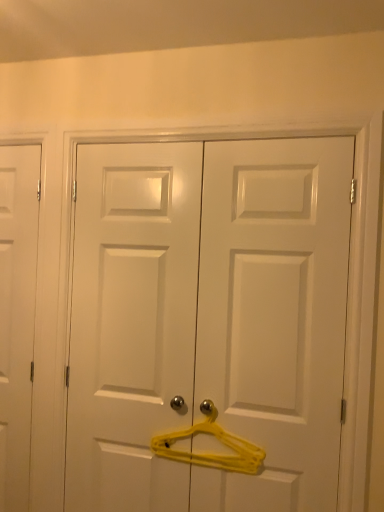
Question: Is white matte door at left, the first door viewed from the left, shorter than white glossy door at center, arranged as the 2th door when viewed from the left?

Choices:
 (A) no
 (B) yes

Answer: (A)

Question: Is white matte door at left, which is the 2th door from front to back, touching white glossy door at center, the first door from the front?

Choices:
 (A) yes
 (B) no

Answer: (B)

Question: Considering the relative positions of white matte door at left, which is the 2th door from right to left, and white glossy door at center, placed as the 1th door when sorted from right to left, in the image provided, is white matte door at left, which is the 2th door from right to left, behind white glossy door at center, placed as the 1th door when sorted from right to left,?

Choices:
 (A) no
 (B) yes

Answer: (B)

Question: Considering the relative sizes of white matte door at left, which is the 2th door from right to left, and white glossy door at center, arranged as the 2th door when viewed from the left, in the image provided, is white matte door at left, which is the 2th door from right to left, smaller than white glossy door at center, arranged as the 2th door when viewed from the left,?

Choices:
 (A) no
 (B) yes

Answer: (B)

Question: From a real-world perspective, is white matte door at left, the first door when ordered from back to front, positioned over white glossy door at center, the first door from the front, based on gravity?

Choices:
 (A) yes
 (B) no

Answer: (B)

Question: From the image's perspective, is white glossy door at center, arranged as the 2th door when viewed from the left, located above or below yellow plastic hanger at center?

Choices:
 (A) below
 (B) above

Answer: (B)

Question: Looking at their shapes, would you say white glossy door at center, arranged as the 2th door when viewed from the left, is wider or thinner than yellow plastic hanger at center?

Choices:
 (A) wide
 (B) thin

Answer: (A)

Question: Is point (309, 346) closer or farther from the camera than point (172, 449)?

Choices:
 (A) closer
 (B) farther

Answer: (A)

Question: Looking at the image, does white glossy door at center, marked as the 2th door in a back-to-front arrangement, seem bigger or smaller compared to yellow plastic hanger at center?

Choices:
 (A) small
 (B) big

Answer: (B)

Question: From a real-world perspective, is yellow plastic hanger at center positioned above or below white glossy door at center, the first door from the front?

Choices:
 (A) below
 (B) above

Answer: (A)

Question: From the image's perspective, relative to white glossy door at center, marked as the 2th door in a back-to-front arrangement, is yellow plastic hanger at center above or below?

Choices:
 (A) below
 (B) above

Answer: (A)

Question: In terms of width, does yellow plastic hanger at center look wider or thinner when compared to white glossy door at center, the first door from the front?

Choices:
 (A) wide
 (B) thin

Answer: (B)

Question: Is point (223, 460) positioned closer to the camera than point (119, 452)?

Choices:
 (A) closer
 (B) farther

Answer: (A)

Question: In the image, is yellow plastic hanger at center on the left side or the right side of white matte door at left, which is the 2th door from front to back?

Choices:
 (A) left
 (B) right

Answer: (B)

Question: From a real-world perspective, relative to white matte door at left, which is the 2th door from front to back, is yellow plastic hanger at center vertically above or below?

Choices:
 (A) above
 (B) below

Answer: (B)